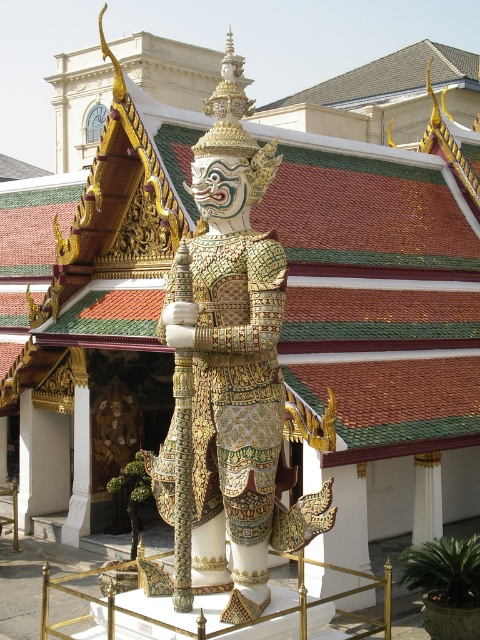
Which is behind, point (195, 371) or point (431, 480)?

The point (431, 480) is more distant.

Does gold textured armor at center have a lesser width compared to white marble pillar at center?

In fact, gold textured armor at center might be wider than white marble pillar at center.

Does point (242, 540) come farther from viewer compared to point (428, 467)?

That is False.

Locate an element on the screen. The image size is (480, 640). gold textured armor at center is located at coordinates (237, 365).